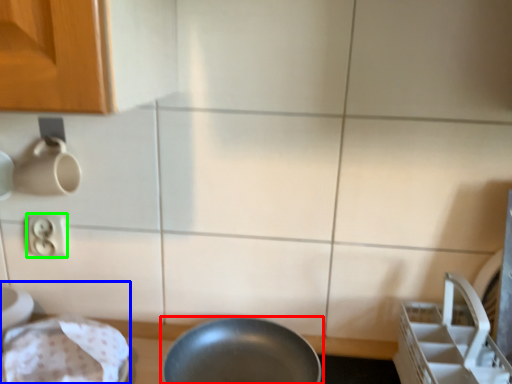
Question: Estimate the real-world distances between objects in this image. Which object is farther from frying pan (highlighted by a red box), sink (highlighted by a blue box) or electric outlet (highlighted by a green box)?

Choices:
 (A) sink
 (B) electric outlet

Answer: (B)